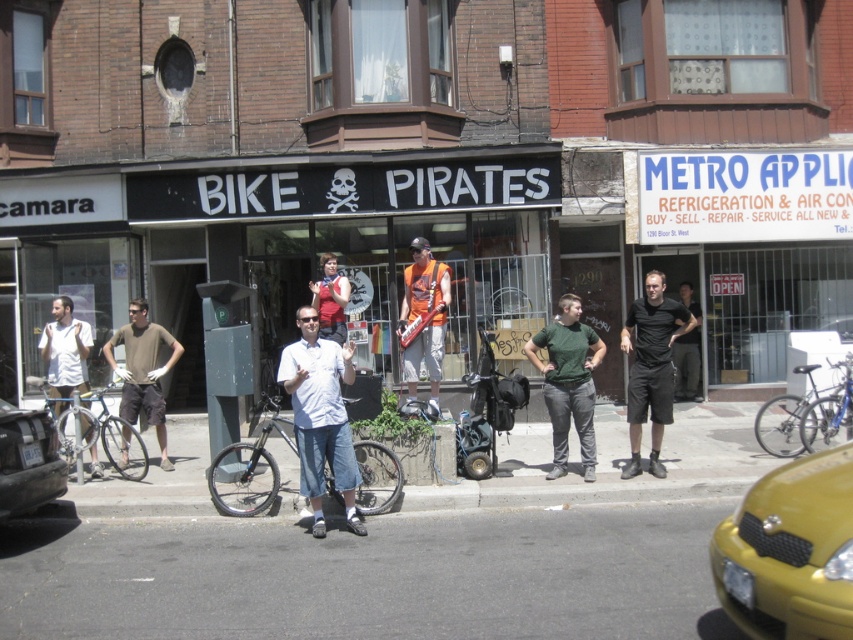
You are a photographer trying to capture a detailed shot of the black matte shorts at center and the orange fabric guitar at center. Since the camera can only focus on one object at a time, which object should you choose to ensure the smaller one is in focus?

The black matte shorts at center is smaller than the orange fabric guitar at center, so you should focus on the black matte shorts at center to ensure the smaller object is in focus.

You are a photographer setting up a tripod in front of Bike Pirates store. You want to ensure the silver metallic bicycle at left and the matte red shirt at center are both in frame. Considering their heights, which object should you adjust the tripod height to focus on first?

The silver metallic bicycle at left is not as tall as matte red shirt at center. Therefore, you should first adjust the tripod height to focus on the matte red shirt at center since it is taller, ensuring it fits within the frame before adjusting for the shorter bicycle.

You are a photographer trying to capture a clear shot of the black matte shorts at center and the black matte car at lower left. Since you want both objects to appear equally prominent in the photo, which one should you zoom in on and why?

You should zoom in on the black matte car at lower left because it is smaller than the black matte shorts at center. By zooming in on the smaller object, you can balance their sizes in the photo, making both appear equally prominent.